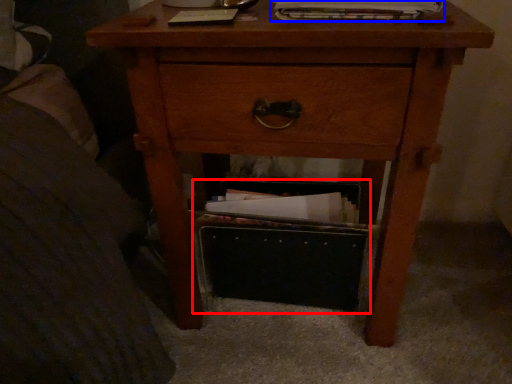
Question: Which object is closer to the camera taking this photo, shoe box (highlighted by a red box) or magazine (highlighted by a blue box)?

Choices:
 (A) shoe box
 (B) magazine

Answer: (B)